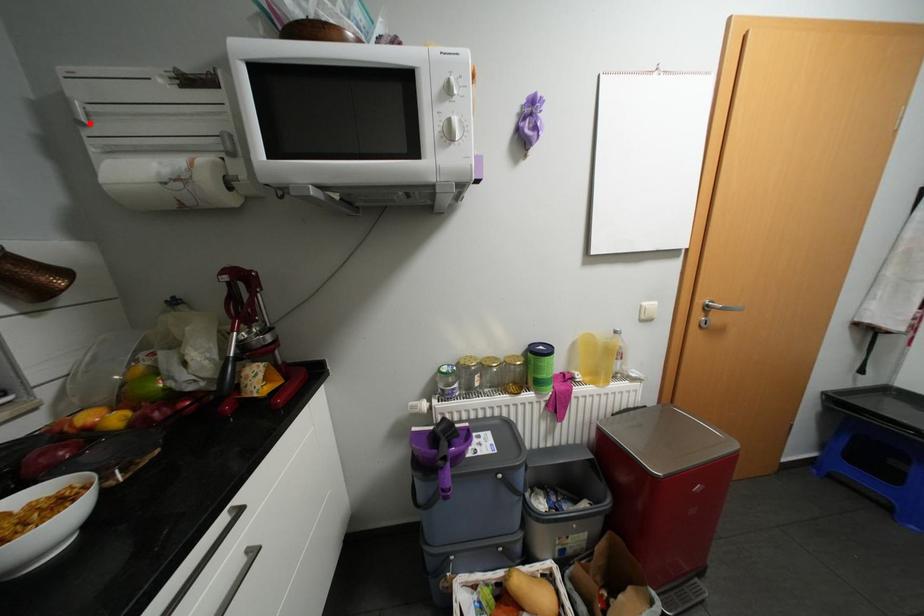
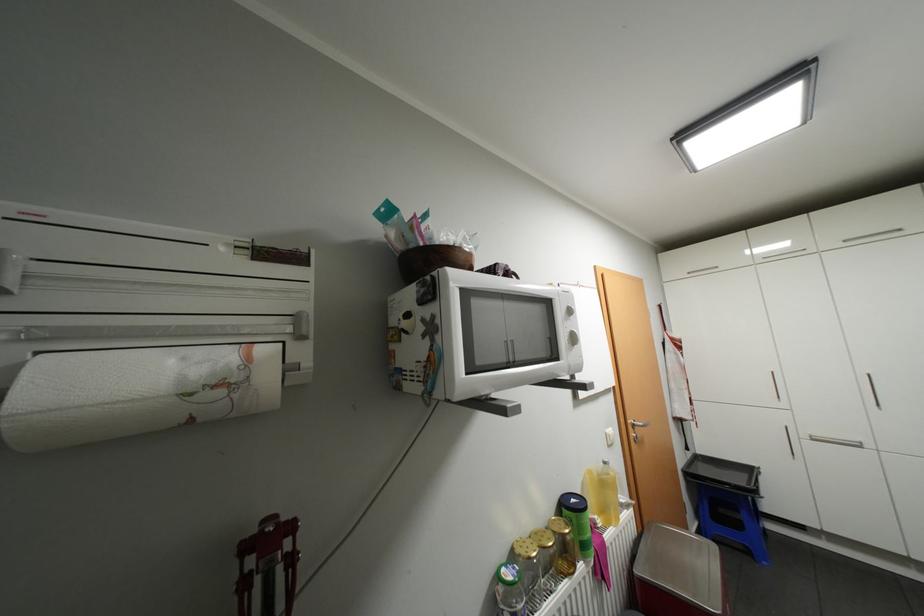
In the second image, find the point that corresponds to the highlighted location in the first image.

(6, 291)